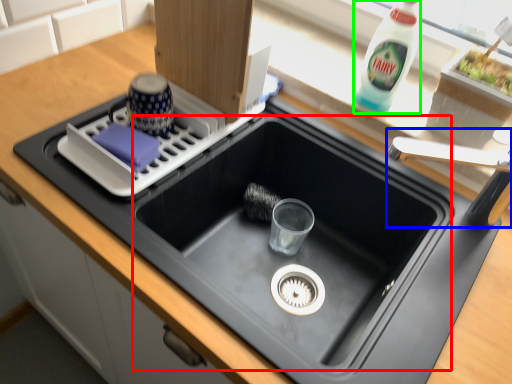
Question: Estimate the real-world distances between objects in this image. Which object is farther from sink (highlighted by a red box), faucet (highlighted by a blue box) or bottle (highlighted by a green box)?

Choices:
 (A) faucet
 (B) bottle

Answer: (B)